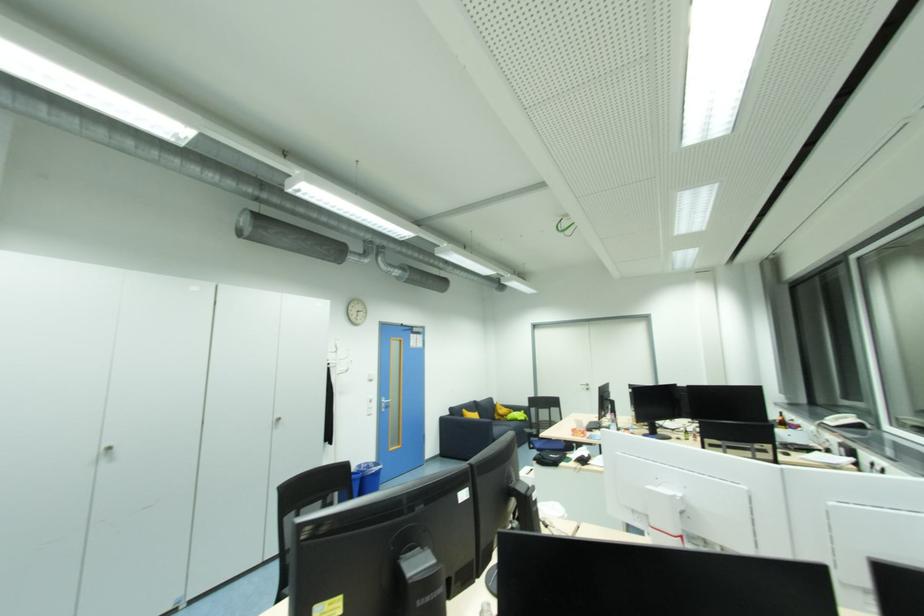
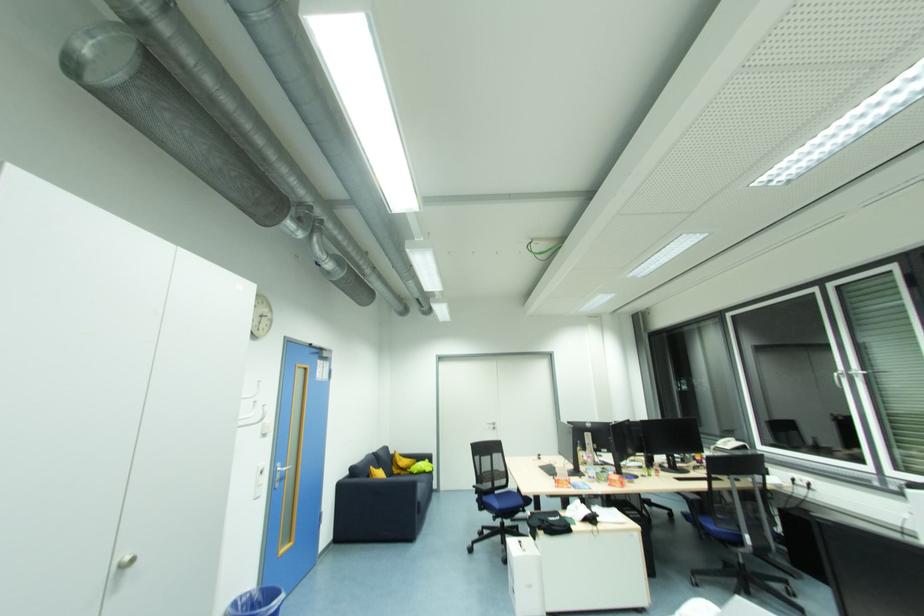
Locate, in the second image, the point that corresponds to the point at 526,413 in the first image.

(430, 461)